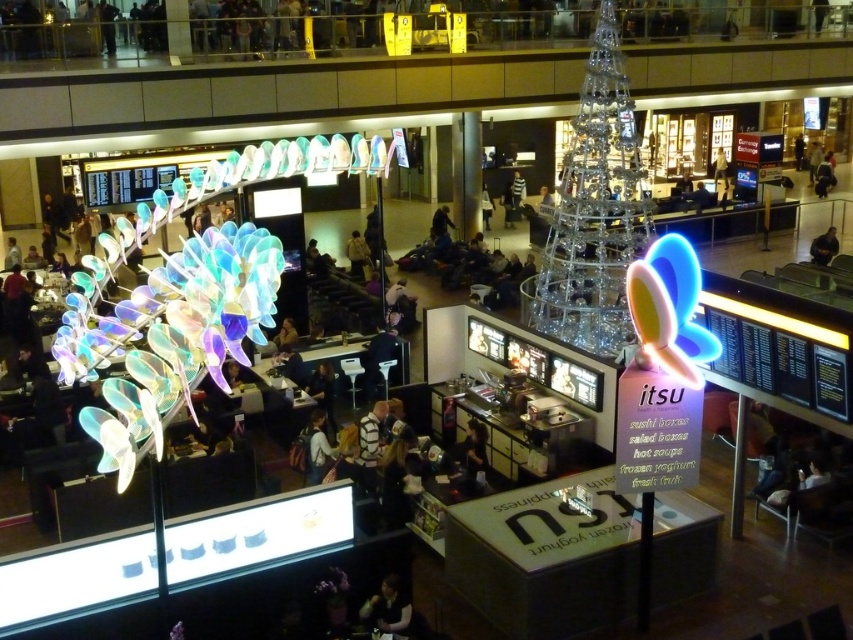
You are a customer looking to purchase a jacket in this scene. You see the dark gray sweater at lower center and the matte black jacket at center. Which one is closer to you?

The dark gray sweater at lower center is closer to you because it is in front of the matte black jacket at center.